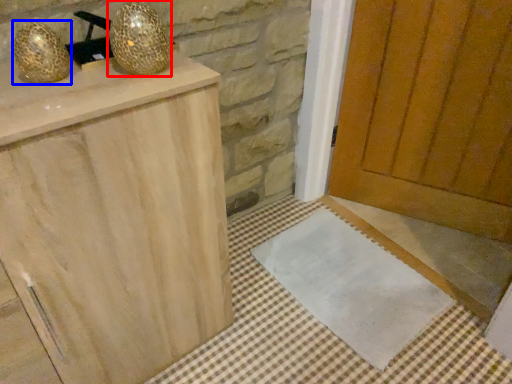
Question: Among these objects, which one is farthest to the camera, disco ball (highlighted by a red box) or disco ball (highlighted by a blue box)?

Choices:
 (A) disco ball
 (B) disco ball

Answer: (A)